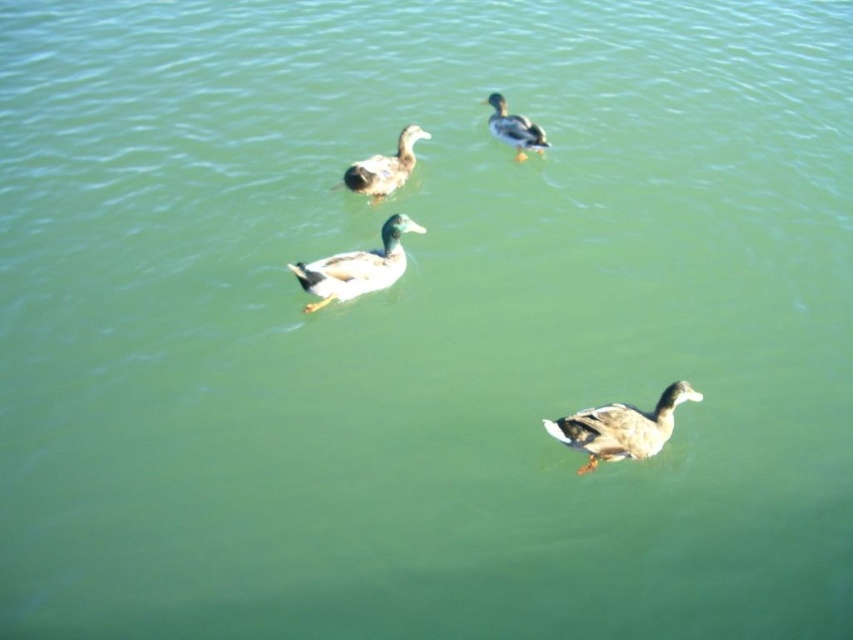
You are observing the ducks in the water. Which duck is positioned lower in the image, the green matte duck at center or the brown matte duck at center?

The green matte duck at center is positioned below the brown matte duck at center, so it is lower in the image.